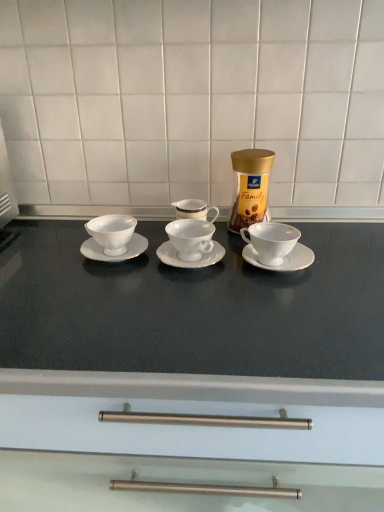
Identify the location of vacant space in front of white porcelain saucer at left, the 1th saucer in the left-to-right sequence. [101, 293].